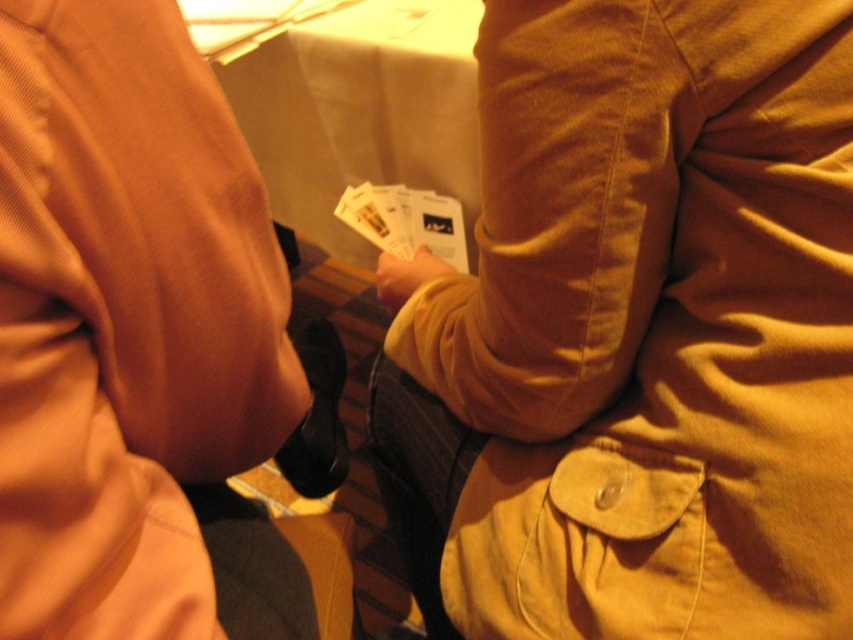
Question: Is matte brown jacket at center to the left of matte yellow hand at center from the viewer's perspective?

Choices:
 (A) no
 (B) yes

Answer: (A)

Question: Among these points, which one is farthest from the camera?

Choices:
 (A) (750, 163)
 (B) (184, 396)
 (C) (380, 291)

Answer: (C)

Question: Is matte orange jacket at upper left bigger than matte yellow hand at center?

Choices:
 (A) no
 (B) yes

Answer: (B)

Question: Estimate the real-world distances between objects in this image. Which object is farther from the matte orange jacket at upper left?

Choices:
 (A) matte brown jacket at center
 (B) matte yellow hand at center

Answer: (B)

Question: Which of the following is the farthest from the observer?

Choices:
 (A) matte orange jacket at upper left
 (B) matte brown jacket at center
 (C) matte yellow hand at center

Answer: (C)

Question: Is the position of matte brown jacket at center less distant than that of matte orange jacket at upper left?

Choices:
 (A) no
 (B) yes

Answer: (A)